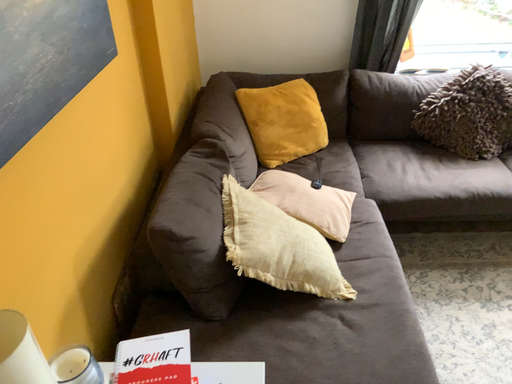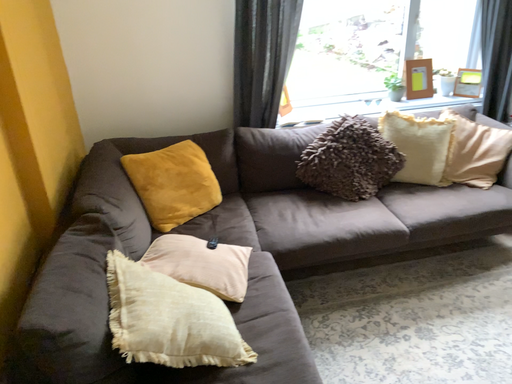
Question: Which way did the camera rotate in the video?

Choices:
 (A) rotated upward
 (B) rotated downward

Answer: (A)